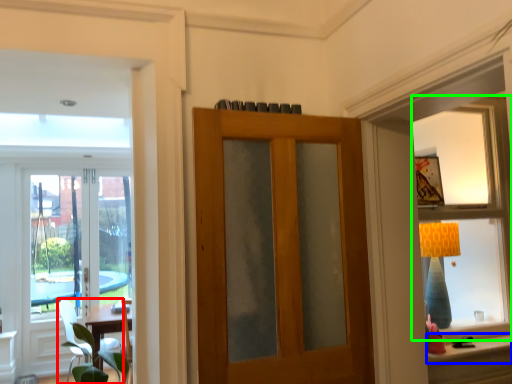
Question: Which is nearer to the chair (highlighted by a red box)? window sill (highlighted by a blue box) or window (highlighted by a green box).

Choices:
 (A) window sill
 (B) window

Answer: (A)